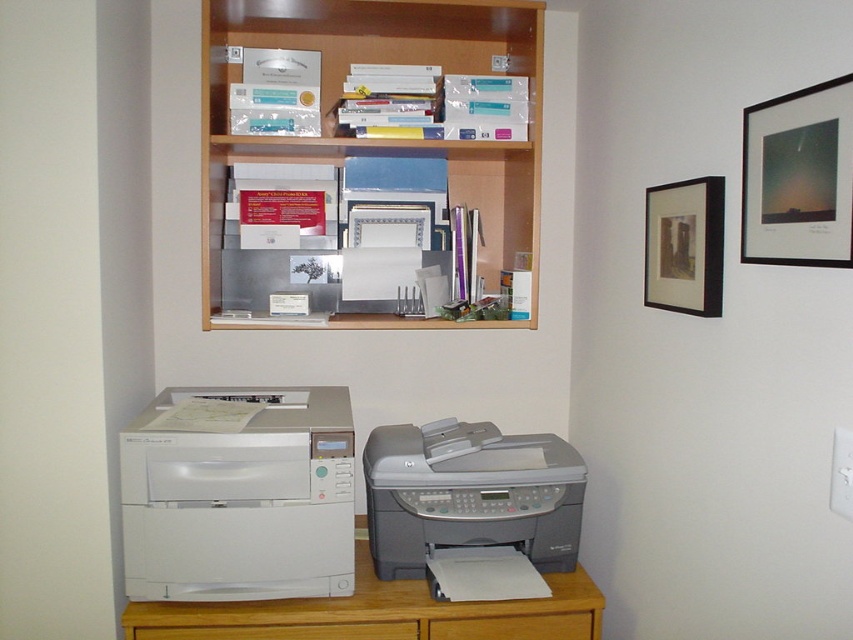
Does point (531, 467) come in front of point (646, 256)?

No, it is behind (646, 256).

Does gray matte printer at lower center have a greater height compared to black matte picture frame at upper right?

Yes, gray matte printer at lower center is taller than black matte picture frame at upper right.

Which is behind, point (556, 570) or point (688, 211)?

The point (556, 570) is more distant.

This screenshot has height=640, width=853. What are the coordinates of `gray matte printer at lower center` in the screenshot? It's located at (473, 508).

Between matte black picture frame at upper right and wooden drawer at lower center, which one has more height?

matte black picture frame at upper right

Is matte black picture frame at upper right positioned at the back of wooden drawer at lower center?

No, matte black picture frame at upper right is in front of wooden drawer at lower center.

Is point (767, 140) positioned in front of point (553, 632)?

Yes, point (767, 140) is closer to viewer.

At what (x,y) coordinates should I click in order to perform the action: click on matte black picture frame at upper right. Please return your answer as a coordinate pair (x, y). This screenshot has height=640, width=853. Looking at the image, I should click on (798, 177).

Does point (223, 438) lie behind point (575, 570)?

No.

Is white matte printer at lower left to the left of white wood dresser at lower left from the viewer's perspective?

Yes, white matte printer at lower left is to the left of white wood dresser at lower left.

Image resolution: width=853 pixels, height=640 pixels. Find the location of `white matte printer at lower left`. white matte printer at lower left is located at coordinates (239, 493).